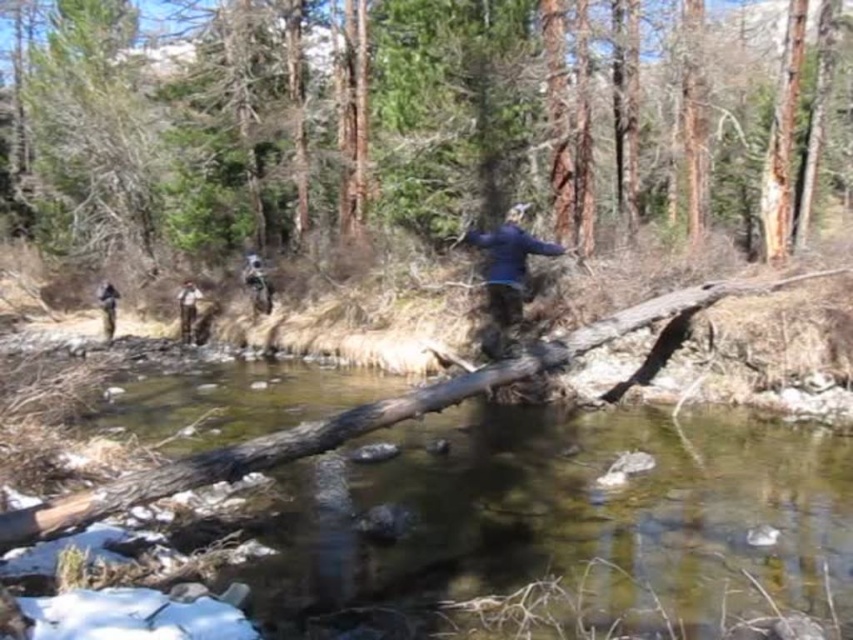
You are planning to cross the stream using the fallen tree trunk. Considering the transparent water at center and the dark blue jacket at center, which one is lower in height? Please explain your reasoning based on the scene description.

The transparent water at center is not as tall as the dark blue jacket at center, meaning the water is lower in height compared to the jacket.

You are standing at the point marked by the coordinates point [563,520] in the scene. What type of surface are you currently standing on?

The point [563,520] marks transparent water at center, so you are standing on transparent water at center.

You are standing at the point labeled point [192,296] and want to move to the point labeled point [492,252]. Which direction should you face to walk towards the point labeled point 0.395, 079?

The point labeled point [492,252] is closer to the camera than the point labeled point [192,296]. Therefore, to move towards point [492,252] from point [192,296], you should face towards the camera or forward direction.